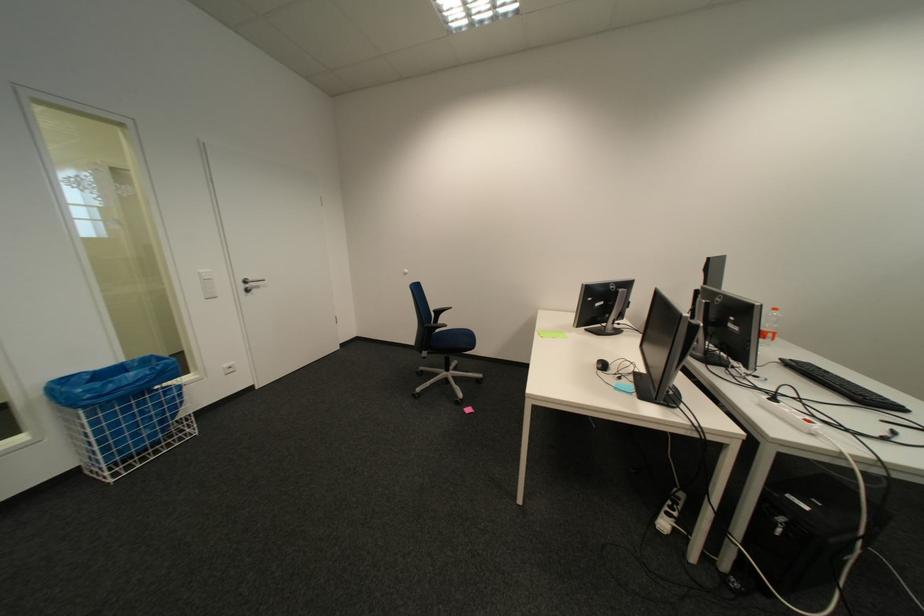
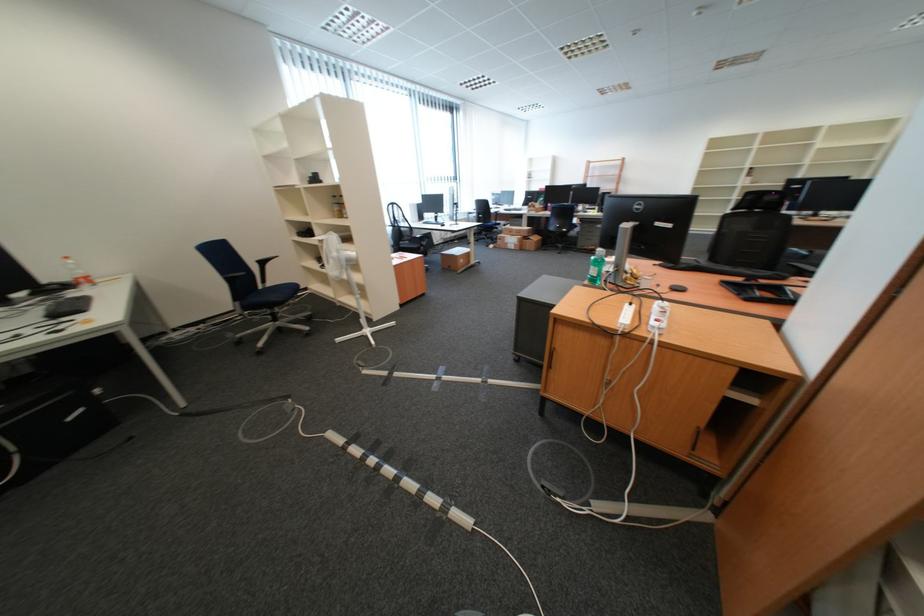
The point at (782, 336) is marked in the first image. Where is the corresponding point in the second image?

(93, 282)